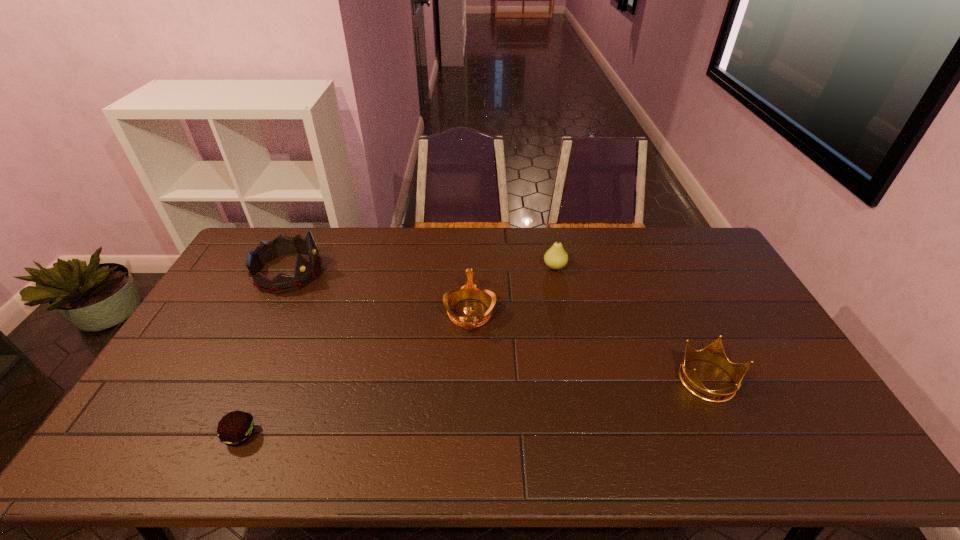
Where is `free space located on the left of the pear`? The height and width of the screenshot is (540, 960). free space located on the left of the pear is located at coordinates (465, 267).

Where is `vacant point located 0.150m at the front emblem of the shorter tiara`? Image resolution: width=960 pixels, height=540 pixels. vacant point located 0.150m at the front emblem of the shorter tiara is located at coordinates (468, 379).

Where is `free region located 0.170m on the right of the fourth farthest object`? The width and height of the screenshot is (960, 540). free region located 0.170m on the right of the fourth farthest object is located at coordinates (802, 381).

The height and width of the screenshot is (540, 960). Identify the location of vacant space located 0.340m on the back of the shortest object. (291, 322).

Image resolution: width=960 pixels, height=540 pixels. I want to click on tiara located in the far edge section of the desktop, so click(x=305, y=272).

In order to click on pear located in the far edge section of the desktop in this screenshot , I will do `click(556, 257)`.

Identify the location of object located at the near edge. The width and height of the screenshot is (960, 540). (235, 428).

Identify the location of object at the left edge. (305, 272).

You are a GUI agent. You are given a task and a screenshot of the screen. Output one action in this format:
    pyautogui.click(x=<x>, y=<y>)
    Task: Click on the object that is at the far left corner
    The width and height of the screenshot is (960, 540).
    Given the screenshot: What is the action you would take?
    pyautogui.click(x=305, y=272)

The height and width of the screenshot is (540, 960). I want to click on vacant space at the far edge, so click(x=592, y=237).